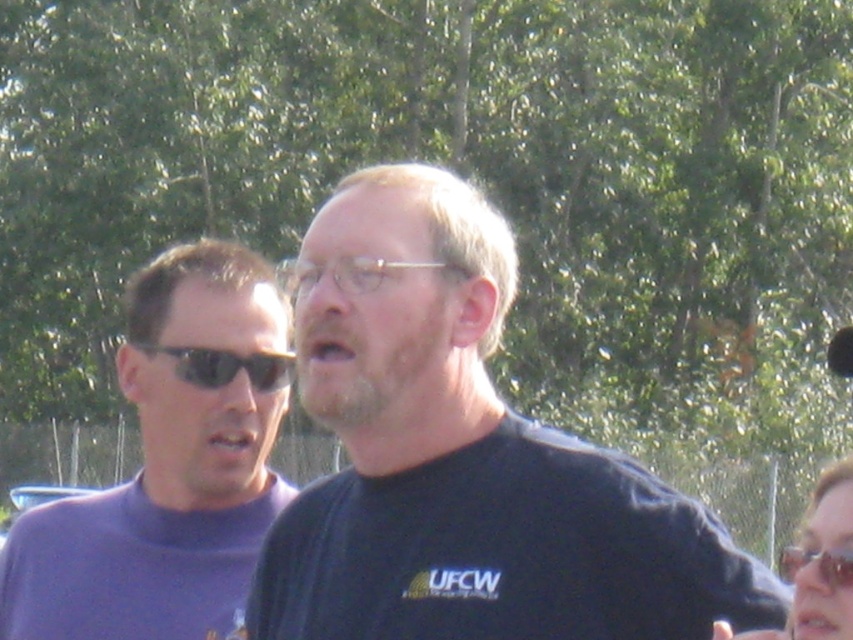
Question: Does black matte shirt at center have a larger size compared to clear plastic goggles at center?

Choices:
 (A) no
 (B) yes

Answer: (A)

Question: Which object is the closest to the black plastic sunglasses at left?

Choices:
 (A) black matte shirt at center
 (B) purple turtleneck sweater at left

Answer: (B)

Question: Considering the real-world distances, which object is closest to the black plastic sunglasses at left?

Choices:
 (A) purple turtleneck sweater at left
 (B) clear plastic glasses at center
 (C) black matte shirt at center

Answer: (A)

Question: Which point is farther to the camera?

Choices:
 (A) clear plastic goggles at center
 (B) black matte shirt at center

Answer: (B)

Question: Can you confirm if clear plastic glasses at center is positioned above clear plastic goggles at center?

Choices:
 (A) yes
 (B) no

Answer: (A)

Question: Is black matte shirt at center wider than purple turtleneck sweater at left?

Choices:
 (A) yes
 (B) no

Answer: (B)